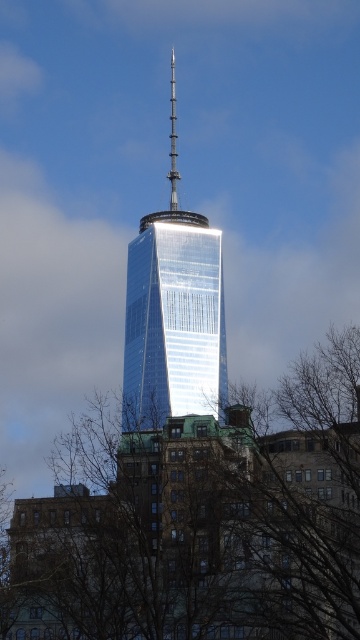
Between shiny glass skyscraper at center and polished silver spire at center, which one appears on the right side from the viewer's perspective?

Positioned to the right is shiny glass skyscraper at center.

Does shiny glass skyscraper at center appear over polished silver spire at center?

No.

Which is in front, point (186, 310) or point (171, 189)?

Point (186, 310)

Find the location of a particular element. shiny glass skyscraper at center is located at coordinates click(x=173, y=314).

Is brown leafless branches at lower center further to the viewer compared to polished silver spire at center?

That is False.

Which of these two, brown leafless branches at lower center or polished silver spire at center, stands taller?

Standing taller between the two is brown leafless branches at lower center.

Is point (327, 636) more distant than point (174, 100)?

No, it is in front of (174, 100).

Find the location of a particular element. This screenshot has height=640, width=360. brown leafless branches at lower center is located at coordinates (201, 522).

Can you confirm if brown leafless branches at lower center is positioned below shiny glass skyscraper at center?

Yes, brown leafless branches at lower center is below shiny glass skyscraper at center.

Does brown leafless branches at lower center appear on the left side of shiny glass skyscraper at center?

No, brown leafless branches at lower center is not to the left of shiny glass skyscraper at center.

Is point (358, 420) farther from camera compared to point (191, 312)?

Yes, it is.

Find the location of `brown leafless branches at lower center`. brown leafless branches at lower center is located at coordinates (201, 522).